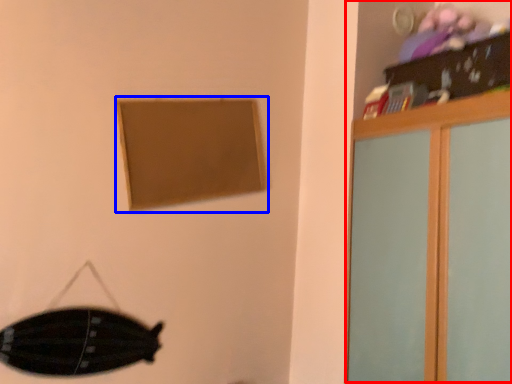
Question: Which of the following is the closest to the observer, dresser (highlighted by a red box) or picture frame (highlighted by a blue box)?

Choices:
 (A) dresser
 (B) picture frame

Answer: (A)